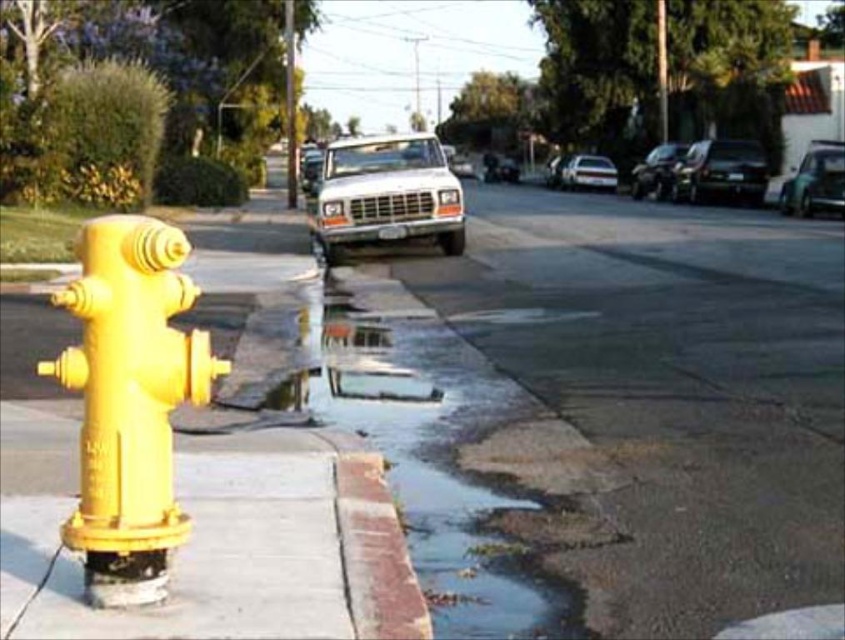
You are a delivery person needing to unload a tall package that is 6 feet high. You see the glossy black car at upper right and the metallic silver sedan at center. Which vehicle should you avoid parking near to prevent damaging the package?

You should avoid parking near the glossy black car at upper right because it is much taller than the metallic silver sedan at center, so the package might hit the car if placed too close.

You are standing at the fire hydrant and want to walk to the glossy black car at upper right. Based on the coordinates provided, in which general direction should you head?

The glossy black car at upper right is located at coordinates point (657, 170), so you should head towards the upper right direction from the fire hydrant.